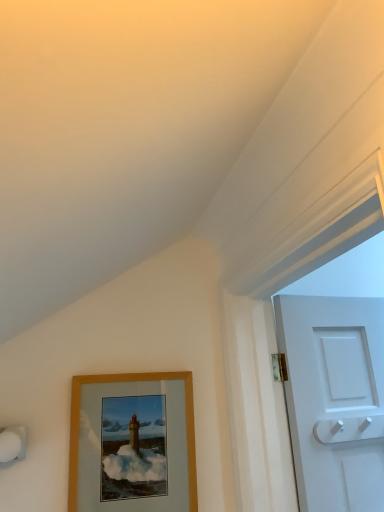
Question: From a real-world perspective, is wooden frame at lower left physically located above or below white plastic door handle at right?

Choices:
 (A) below
 (B) above

Answer: (A)

Question: Would you say wooden frame at lower left is inside or outside white plastic door handle at right?

Choices:
 (A) outside
 (B) inside

Answer: (A)

Question: Does point (114, 380) appear closer or farther from the camera than point (326, 419)?

Choices:
 (A) farther
 (B) closer

Answer: (A)

Question: Is point (354, 438) positioned closer to the camera than point (77, 453)?

Choices:
 (A) closer
 (B) farther

Answer: (B)

Question: In the image, is white plastic door handle at right positioned in front of or behind wooden frame at lower left?

Choices:
 (A) behind
 (B) front

Answer: (A)

Question: Is white plastic door handle at right bigger or smaller than wooden frame at lower left?

Choices:
 (A) big
 (B) small

Answer: (B)

Question: Looking at their shapes, would you say white plastic door handle at right is wider or thinner than wooden frame at lower left?

Choices:
 (A) wide
 (B) thin

Answer: (A)